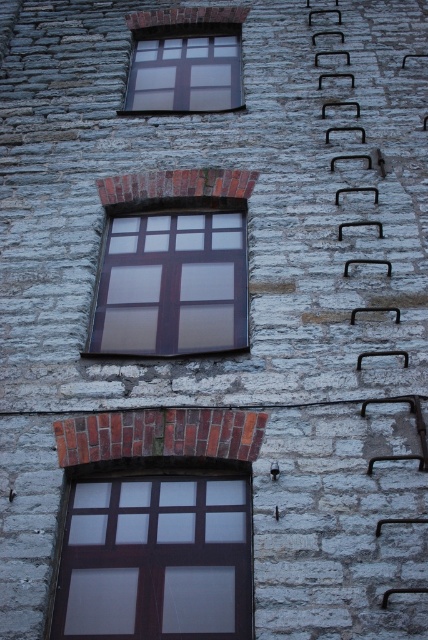
Is matte brown window at center above matte glass window at upper center?

Actually, matte brown window at center is below matte glass window at upper center.

Which is behind, point (151, 237) or point (180, 68)?

Positioned behind is point (180, 68).

You are a GUI agent. You are given a task and a screenshot of the screen. Output one action in this format:
    pyautogui.click(x=<x>, y=<y>)
    Task: Click on the matte brown window at center
    
    Given the screenshot: What is the action you would take?
    pyautogui.click(x=172, y=280)

This screenshot has width=428, height=640. Identify the location of matte brown window at center. (172, 280).

Who is more distant from viewer, (172, 488) or (136, 51)?

Positioned behind is point (136, 51).

Who is more forward, (145, 637) or (136, 44)?

Point (145, 637) is more forward.

Where is `matte brown window at lower center`? Image resolution: width=428 pixels, height=640 pixels. matte brown window at lower center is located at coordinates (155, 557).

Can you confirm if matte brown window at lower center is positioned to the left of matte brown window at center?

No, matte brown window at lower center is not to the left of matte brown window at center.

Which is behind, point (231, 532) or point (165, 200)?

Positioned behind is point (165, 200).

Image resolution: width=428 pixels, height=640 pixels. In order to click on matte brown window at lower center in this screenshot , I will do (155, 557).